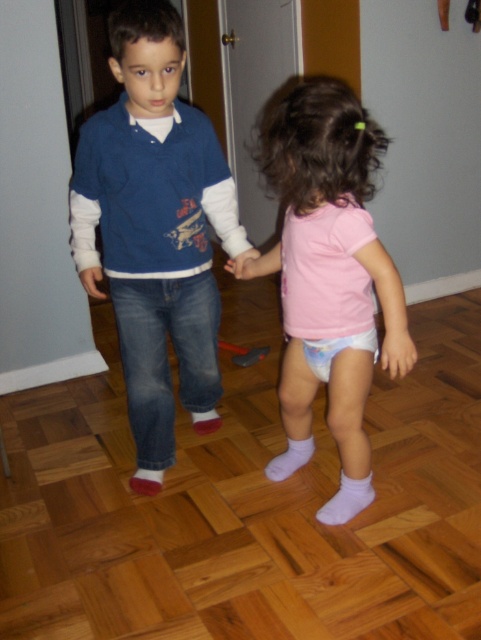
You are a parent trying to dress your child. You see the matte blue sweater at center and the purple cotton sock at lower center. Which item is closer to the left side of the image?

The matte blue sweater at center is to the left of the purple cotton sock at lower center, so it is closer to the left side of the image.

You are a parent trying to dress your child. You have a matte blue sweater at center and a pink fabric sock at lower center. Which item is bigger in size?

The matte blue sweater at center is larger in size compared to the pink fabric sock at lower center.